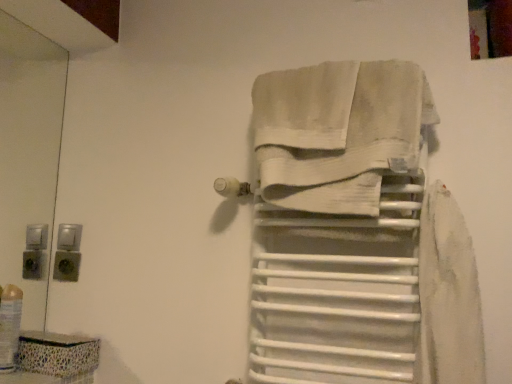
Question: Are translucent plastic bottle at lower left and white matte towel rack at center beside each other?

Choices:
 (A) no
 (B) yes

Answer: (A)

Question: Does translucent plastic bottle at lower left have a greater width compared to white matte towel rack at center?

Choices:
 (A) yes
 (B) no

Answer: (B)

Question: From the image's perspective, is translucent plastic bottle at lower left under white matte towel rack at center?

Choices:
 (A) yes
 (B) no

Answer: (A)

Question: Is translucent plastic bottle at lower left oriented away from white matte towel rack at center?

Choices:
 (A) no
 (B) yes

Answer: (A)

Question: Is translucent plastic bottle at lower left bigger than white matte towel rack at center?

Choices:
 (A) no
 (B) yes

Answer: (A)

Question: From the image's perspective, is translucent plastic bottle at lower left positioned above or below white matte towel rack at center?

Choices:
 (A) above
 (B) below

Answer: (B)

Question: In terms of width, does translucent plastic bottle at lower left look wider or thinner when compared to white matte towel rack at center?

Choices:
 (A) thin
 (B) wide

Answer: (A)

Question: From their relative heights in the image, would you say translucent plastic bottle at lower left is taller or shorter than white matte towel rack at center?

Choices:
 (A) short
 (B) tall

Answer: (A)

Question: Is translucent plastic bottle at lower left in front of or behind white matte towel rack at center in the image?

Choices:
 (A) front
 (B) behind

Answer: (B)

Question: Would you say white matte towel rack at center is inside or outside translucent plastic bottle at lower left?

Choices:
 (A) inside
 (B) outside

Answer: (B)

Question: From the image's perspective, is white matte towel rack at center located above or below translucent plastic bottle at lower left?

Choices:
 (A) below
 (B) above

Answer: (B)

Question: In terms of width, does white matte towel rack at center look wider or thinner when compared to translucent plastic bottle at lower left?

Choices:
 (A) thin
 (B) wide

Answer: (B)

Question: From a real-world perspective, is white matte towel rack at center positioned above or below translucent plastic bottle at lower left?

Choices:
 (A) above
 (B) below

Answer: (A)

Question: Looking at their shapes, would you say translucent plastic bottle at lower left is wider or thinner than white cotton towel at center?

Choices:
 (A) thin
 (B) wide

Answer: (A)

Question: From a real-world perspective, is translucent plastic bottle at lower left positioned above or below white cotton towel at center?

Choices:
 (A) below
 (B) above

Answer: (A)